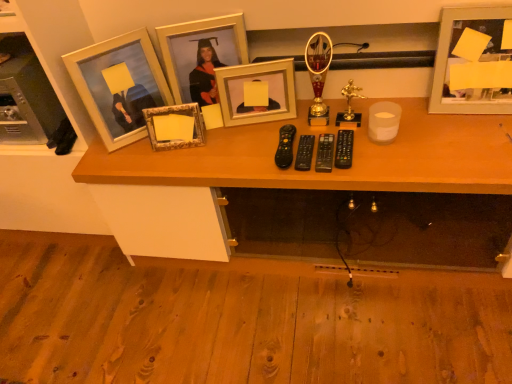
Image resolution: width=512 pixels, height=384 pixels. What are the coordinates of `vacant space situated above wooden desk at center (from a real-world perspective)` in the screenshot? It's located at (325, 129).